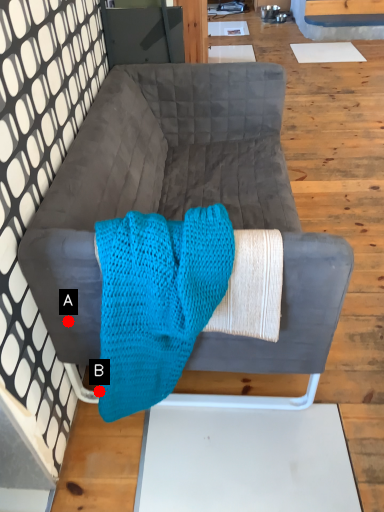
Question: Two points are circled on the image, labeled by A and B beside each circle. Which point is farther from the camera taking this photo?

Choices:
 (A) A is further
 (B) B is further

Answer: (B)